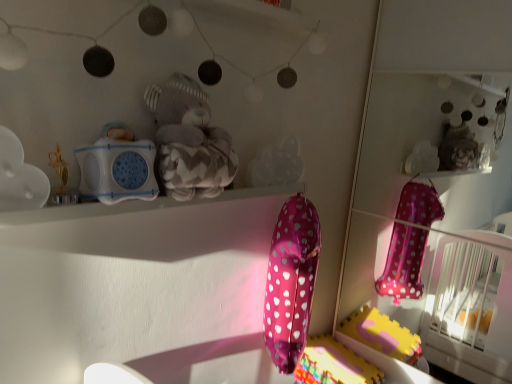
What do you see at coordinates (118, 166) in the screenshot?
I see `white plastic speaker at upper center, which is the 3th toy in right-to-left order` at bounding box center [118, 166].

This screenshot has width=512, height=384. What do you see at coordinates (334, 364) in the screenshot?
I see `pink polka dot balloon at lower center` at bounding box center [334, 364].

What is the approximate width of translucent plastic cloud at center, which is the fourth toy in left-to-right order?

It is 1.72 inches.

Looking at this image, how much space does gray plush teddy bear at upper center, acting as the third toy starting from the left, occupy horizontally?

The width of gray plush teddy bear at upper center, acting as the third toy starting from the left, is 8.58 inches.

Describe the element at coordinates (291, 282) in the screenshot. The image size is (512, 384). I see `pink metallic balloon at center` at that location.

Image resolution: width=512 pixels, height=384 pixels. I want to click on white plastic speaker at upper center, which is the 3th toy in right-to-left order, so click(x=118, y=166).

Could white matte cloud at upper left, the 1th toy from the left, be considered to be inside translucent plastic cloud at center, which appears as the first toy when viewed from the right?

No, translucent plastic cloud at center, which appears as the first toy when viewed from the right, does not contain white matte cloud at upper left, the 1th toy from the left.

From the image's perspective, is translucent plastic cloud at center, which is the fourth toy in left-to-right order, located above or below white matte cloud at upper left, which is counted as the 4th toy, starting from the right?

Based on their image positions, translucent plastic cloud at center, which is the fourth toy in left-to-right order, is located above white matte cloud at upper left, which is counted as the 4th toy, starting from the right.

Is translucent plastic cloud at center, which is the fourth toy in left-to-right order, wider or thinner than white matte cloud at upper left, which is counted as the 4th toy, starting from the right?

In the image, translucent plastic cloud at center, which is the fourth toy in left-to-right order, appears to be more narrow than white matte cloud at upper left, which is counted as the 4th toy, starting from the right.

Is pink metallic balloon at center oriented towards pink polka dot balloon at lower center?

No, pink metallic balloon at center is not aimed at pink polka dot balloon at lower center.

Is pink polka dot balloon at lower center surrounded by pink metallic balloon at center?

No, pink polka dot balloon at lower center is not surrounded by pink metallic balloon at center.

How far apart are pink metallic balloon at center and pink polka dot balloon at lower center?

pink metallic balloon at center is 13.84 inches away from pink polka dot balloon at lower center.

From the image's perspective, does pink metallic balloon at center appear higher than pink polka dot balloon at lower center?

Yes, from the image's perspective, pink metallic balloon at center is on top of pink polka dot balloon at lower center.

Is pink polka dot balloon at lower center at the right side of white matte cloud at upper left, which is counted as the 4th toy, starting from the right?

Yes.

Is pink polka dot balloon at lower center spatially inside white matte cloud at upper left, the 1th toy from the left, or outside of it?

pink polka dot balloon at lower center lies outside white matte cloud at upper left, the 1th toy from the left.

Is pink polka dot balloon at lower center aimed at white matte cloud at upper left, which is counted as the 4th toy, starting from the right?

No.

Based on the photo, how different are the orientations of gray plush teddy bear at upper center, acting as the third toy starting from the left, and pink polka dot balloon at lower center in degrees?

4.22 degrees separate the facing orientations of gray plush teddy bear at upper center, acting as the third toy starting from the left, and pink polka dot balloon at lower center.

Are gray plush teddy bear at upper center, acting as the third toy starting from the left, and pink polka dot balloon at lower center located far from each other?

Yes.

From the image's perspective, which one is positioned higher, gray plush teddy bear at upper center, acting as the third toy starting from the left, or pink polka dot balloon at lower center?

gray plush teddy bear at upper center, acting as the third toy starting from the left.

Find the location of a particular element. clothing located behind the gray plush teddy bear at upper center, acting as the third toy starting from the left is located at coordinates pyautogui.click(x=334, y=364).

Looking at their sizes, would you say white matte cloud at upper left, which is counted as the 4th toy, starting from the right, is wider or thinner than gray plush teddy bear at upper center, the second toy when ordered from right to left?

Considering their sizes, white matte cloud at upper left, which is counted as the 4th toy, starting from the right, looks slimmer than gray plush teddy bear at upper center, the second toy when ordered from right to left.

From the image's perspective, count 3rd toys upward from the white matte cloud at upper left, which is counted as the 4th toy, starting from the right, and point to it. Please provide its 2D coordinates.

[(189, 141)]

Between point (3, 133) and point (201, 127), which one is positioned behind?

Point (201, 127)

From a real-world perspective, is white matte cloud at upper left, which is counted as the 4th toy, starting from the right, located higher than gray plush teddy bear at upper center, the second toy when ordered from right to left?

No, from a real-world perspective, white matte cloud at upper left, which is counted as the 4th toy, starting from the right, is not on top of gray plush teddy bear at upper center, the second toy when ordered from right to left.

Can you confirm if gray plush teddy bear at upper center, acting as the third toy starting from the left, is positioned to the right of translucent plastic cloud at center, which is the fourth toy in left-to-right order?

No.

In the scene shown: From a real-world perspective, is gray plush teddy bear at upper center, acting as the third toy starting from the left, on translucent plastic cloud at center, which is the fourth toy in left-to-right order?

Indeed, from a real-world perspective, gray plush teddy bear at upper center, acting as the third toy starting from the left, stands above translucent plastic cloud at center, which is the fourth toy in left-to-right order.

In terms of width, does gray plush teddy bear at upper center, acting as the third toy starting from the left, look wider or thinner when compared to translucent plastic cloud at center, which is the fourth toy in left-to-right order?

Clearly, gray plush teddy bear at upper center, acting as the third toy starting from the left, has more width compared to translucent plastic cloud at center, which is the fourth toy in left-to-right order.

Consider the image. Is gray plush teddy bear at upper center, acting as the third toy starting from the left, outside of translucent plastic cloud at center, which appears as the first toy when viewed from the right?

Yes, gray plush teddy bear at upper center, acting as the third toy starting from the left, is located beyond the bounds of translucent plastic cloud at center, which appears as the first toy when viewed from the right.

Is point (294, 277) closer to viewer compared to point (156, 101)?

No.

In the scene shown: From a real-world perspective, is pink metallic balloon at center located beneath gray plush teddy bear at upper center, the second toy when ordered from right to left?

Correct, in the physical world, pink metallic balloon at center is lower than gray plush teddy bear at upper center, the second toy when ordered from right to left.

Considering the positions of objects pink metallic balloon at center and gray plush teddy bear at upper center, the second toy when ordered from right to left, in the image provided, who is more to the right, pink metallic balloon at center or gray plush teddy bear at upper center, the second toy when ordered from right to left,?

From the viewer's perspective, pink metallic balloon at center appears more on the right side.

Who is bigger, pink metallic balloon at center or gray plush teddy bear at upper center, the second toy when ordered from right to left?

gray plush teddy bear at upper center, the second toy when ordered from right to left, is bigger.

Image resolution: width=512 pixels, height=384 pixels. In order to click on the 1st toy above the translucent plastic cloud at center, which is the fourth toy in left-to-right order (from a real-world perspective) in this screenshot , I will do `click(19, 177)`.

Where is `baby clothe above the pink polka dot balloon at lower center (from the image's perspective)`? baby clothe above the pink polka dot balloon at lower center (from the image's perspective) is located at coordinates (291, 282).

Looking at the image, which one is located closer to translucent plastic cloud at center, which is the fourth toy in left-to-right order, pink metallic balloon at center or gray plush teddy bear at upper center, acting as the third toy starting from the left?

Based on the image, pink metallic balloon at center appears to be nearer to translucent plastic cloud at center, which is the fourth toy in left-to-right order.

Looking at the image, which one is located closer to white plastic speaker at upper center, which is the 3th toy in right-to-left order, pink polka dot balloon at lower center or white matte cloud at upper left, which is counted as the 4th toy, starting from the right?

white matte cloud at upper left, which is counted as the 4th toy, starting from the right.

From the image, which object appears to be nearer to gray plush teddy bear at upper center, acting as the third toy starting from the left, white matte cloud at upper left, which is counted as the 4th toy, starting from the right, or white plastic speaker at upper center, which is the 3th toy in right-to-left order?

white plastic speaker at upper center, which is the 3th toy in right-to-left order, is closer to gray plush teddy bear at upper center, acting as the third toy starting from the left.

Based on their spatial positions, is white plastic speaker at upper center, which is the 3th toy in right-to-left order, or pink polka dot balloon at lower center closer to white matte cloud at upper left, which is counted as the 4th toy, starting from the right?

white plastic speaker at upper center, which is the 3th toy in right-to-left order.

Considering their positions, is gray plush teddy bear at upper center, the second toy when ordered from right to left, positioned closer to white plastic speaker at upper center, which is counted as the 2th toy, starting from the left, than pink polka dot balloon at lower center?

gray plush teddy bear at upper center, the second toy when ordered from right to left, is positioned closer to the anchor white plastic speaker at upper center, which is counted as the 2th toy, starting from the left.

Based on their spatial positions, is pink metallic balloon at center or gray plush teddy bear at upper center, the second toy when ordered from right to left, further from white plastic speaker at upper center, which is the 3th toy in right-to-left order?

Based on the image, pink metallic balloon at center appears to be further to white plastic speaker at upper center, which is the 3th toy in right-to-left order.

Based on their spatial positions, is pink metallic balloon at center or white matte cloud at upper left, the 1th toy from the left, further from pink polka dot balloon at lower center?

white matte cloud at upper left, the 1th toy from the left, lies further to pink polka dot balloon at lower center than the other object.

Based on their spatial positions, is gray plush teddy bear at upper center, acting as the third toy starting from the left, or white matte cloud at upper left, which is counted as the 4th toy, starting from the right, closer to translucent plastic cloud at center, which is the fourth toy in left-to-right order?

gray plush teddy bear at upper center, acting as the third toy starting from the left.

Identify the location of toy situated between white matte cloud at upper left, which is counted as the 4th toy, starting from the right, and gray plush teddy bear at upper center, acting as the third toy starting from the left, from left to right. The image size is (512, 384). point(118,166).

Where is `toy that lies between white plastic speaker at upper center, which is counted as the 2th toy, starting from the left, and pink polka dot balloon at lower center from top to bottom`? toy that lies between white plastic speaker at upper center, which is counted as the 2th toy, starting from the left, and pink polka dot balloon at lower center from top to bottom is located at coordinates (19, 177).

What are the coordinates of `baby clothe that lies between translucent plastic cloud at center, which appears as the first toy when viewed from the right, and pink polka dot balloon at lower center from top to bottom` in the screenshot? It's located at (291, 282).

The height and width of the screenshot is (384, 512). I want to click on baby clothe between gray plush teddy bear at upper center, acting as the third toy starting from the left, and pink polka dot balloon at lower center in the up-down direction, so click(x=291, y=282).